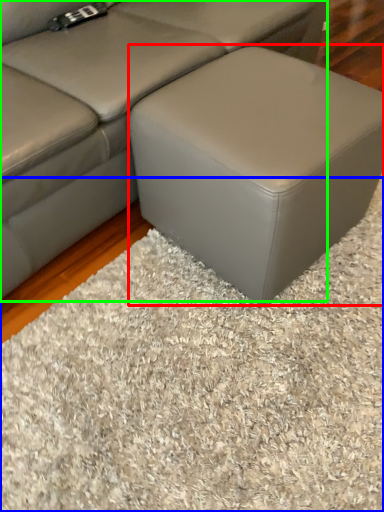
Question: Considering the real-world distances, which object is closest to stool (highlighted by a red box)? mat (highlighted by a blue box) or studio couch (highlighted by a green box).

Choices:
 (A) mat
 (B) studio couch

Answer: (B)